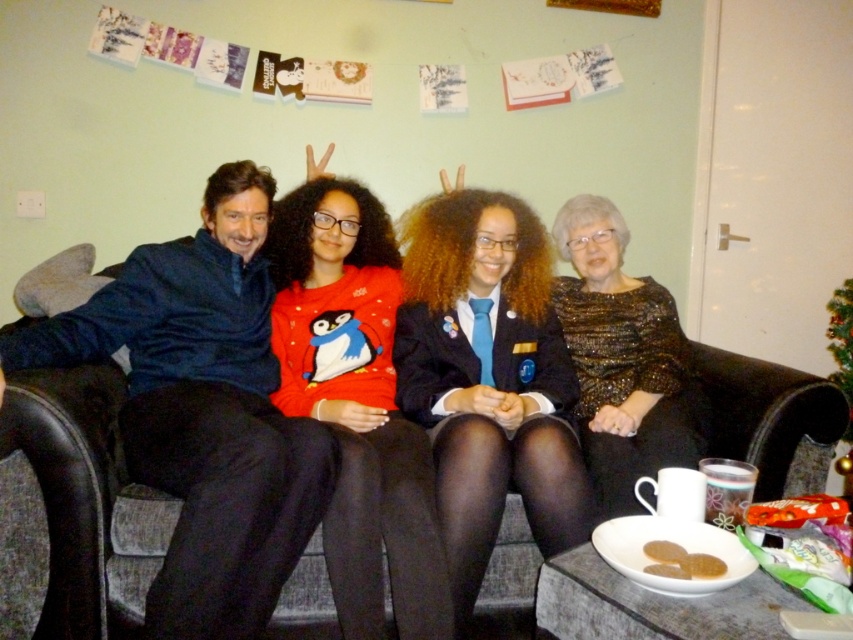
You are a photographer taking a group photo of the people on the sofa. You want to ensure that the blue satin blazer at center and the sparkly gold dress at center are both clearly visible in the photo. Given their current positions, is there enough space between them to focus on both items without overlapping?

The blue satin blazer at center and the sparkly gold dress at center are 10.74 inches apart from each other. This distance should provide sufficient space for the photographer to focus on both items without overlapping, as they are separated by over 10 inches.

You are standing in the living room and want to place a small plant between the two points, point (36, 314) and point (473, 196). Which point should the plant be closer to if you want it to be in front of the wall with the greeting cards?

The plant should be closer to point (473, 196) because point (36, 314) is behind point (473, 196), so placing it near the front point would position it in front of the wall with the greeting cards.